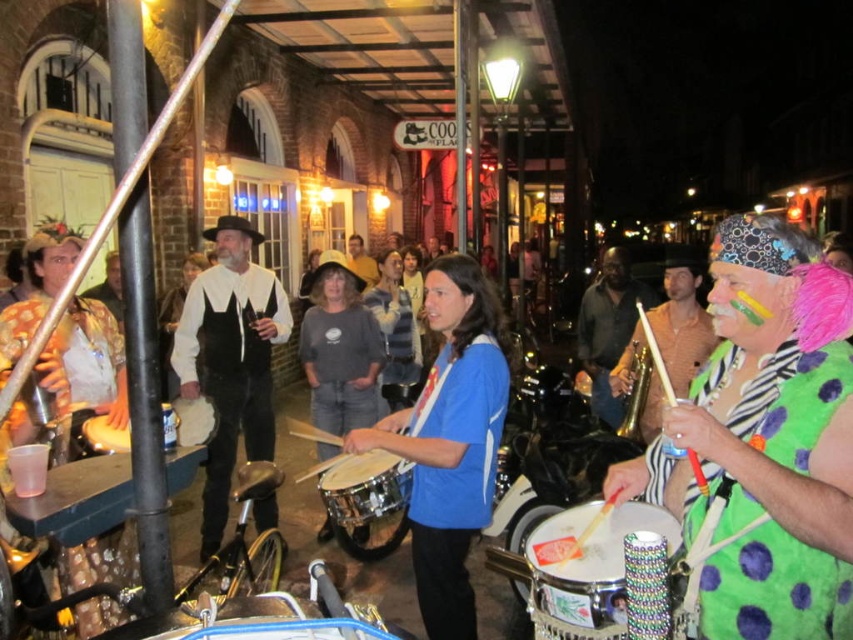
What do you see at coordinates (450, 442) in the screenshot? I see `blue fabric shirt at center` at bounding box center [450, 442].

You are a GUI agent. You are given a task and a screenshot of the screen. Output one action in this format:
    pyautogui.click(x=<x>, y=<y>)
    Task: Click on the blue fabric shirt at center
    The height and width of the screenshot is (640, 853).
    Given the screenshot: What is the action you would take?
    pyautogui.click(x=450, y=442)

At what (x,y) coordinates should I click in order to perform the action: click on blue fabric shirt at center. Please return your answer as a coordinate pair (x, y). The width and height of the screenshot is (853, 640). Looking at the image, I should click on (450, 442).

Locate an element on the screen. The width and height of the screenshot is (853, 640). blue fabric shirt at center is located at coordinates (450, 442).

Can you confirm if matte brown saxophone at center is positioned to the right of gray cotton shirt at center?

Correct, you'll find matte brown saxophone at center to the right of gray cotton shirt at center.

Who is taller, matte brown saxophone at center or gray cotton shirt at center?

Standing taller between the two is gray cotton shirt at center.

Which is in front, point (624, 326) or point (370, 273)?

Point (624, 326) is more forward.

Image resolution: width=853 pixels, height=640 pixels. I want to click on matte brown saxophone at center, so click(x=608, y=328).

Does point (238, 390) come in front of point (631, 378)?

No, it is behind (631, 378).

Which is in front, point (258, 314) or point (634, 396)?

Point (634, 396) is in front.

At what (x,y) coordinates should I click in order to perform the action: click on white matte vest at center. Please return your answer as a coordinate pair (x, y). The image size is (853, 640). Looking at the image, I should click on (x=230, y=360).